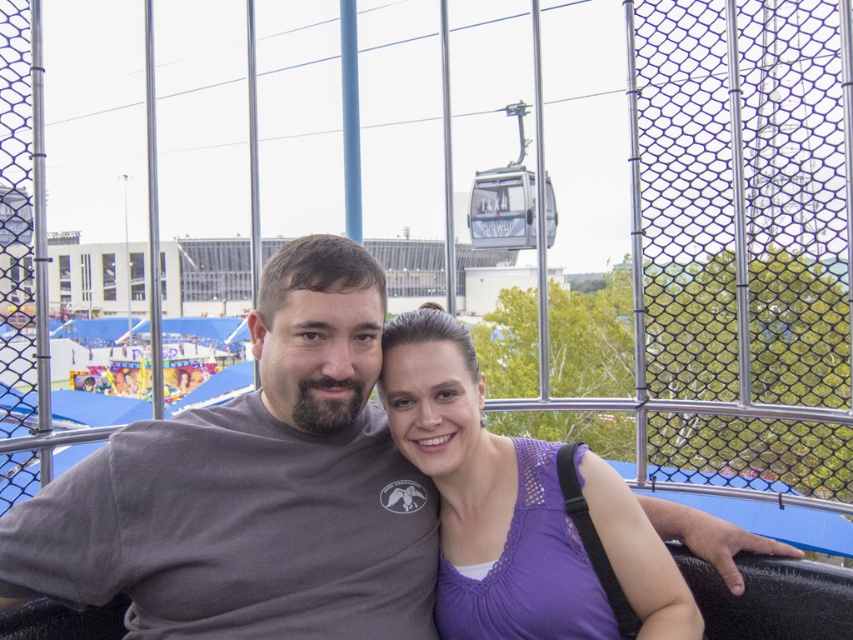
Question: Can you confirm if gray matte shirt at center is wider than purple lace top at center?

Choices:
 (A) yes
 (B) no

Answer: (A)

Question: Based on their relative distances, which object is farther from the purple lace top at center?

Choices:
 (A) gray matte shirt at center
 (B) metal cable car at upper center

Answer: (B)

Question: Considering the real-world distances, which object is farthest from the metal cable car at upper center?

Choices:
 (A) gray matte shirt at center
 (B) purple lace top at center

Answer: (B)

Question: Among these objects, which one is farthest from the camera?

Choices:
 (A) metal cable car at upper center
 (B) purple lace top at center
 (C) gray matte shirt at center

Answer: (A)

Question: Does gray matte shirt at center have a greater width compared to purple lace top at center?

Choices:
 (A) yes
 (B) no

Answer: (A)

Question: Can you confirm if purple lace top at center is positioned above metal cable car at upper center?

Choices:
 (A) yes
 (B) no

Answer: (B)